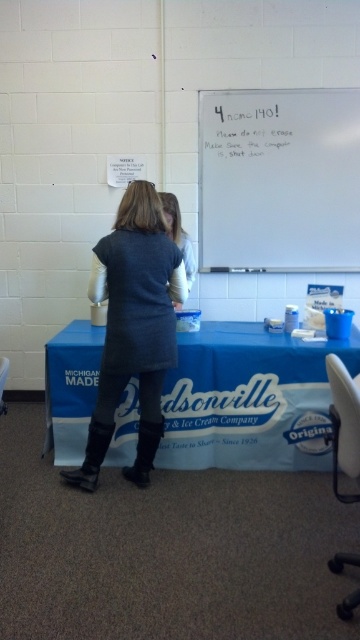
Can you confirm if white matte marker at upper center is positioned above black leather boot at lower left?

Indeed, white matte marker at upper center is positioned over black leather boot at lower left.

Does white matte marker at upper center appear on the left side of black leather boot at lower left?

No, white matte marker at upper center is not to the left of black leather boot at lower left.

Does point (236, 154) come in front of point (92, 464)?

No, (236, 154) is further to viewer.

In order to click on white matte marker at upper center in this screenshot , I will do `click(241, 125)`.

Who is positioned more to the right, black leather boot at lower left or light gray sweater at center?

From the viewer's perspective, light gray sweater at center appears more on the right side.

Who is taller, black leather boot at lower left or light gray sweater at center?

Standing taller between the two is light gray sweater at center.

The width and height of the screenshot is (360, 640). What do you see at coordinates (91, 456) in the screenshot?
I see `black leather boot at lower left` at bounding box center [91, 456].

Image resolution: width=360 pixels, height=640 pixels. I want to click on black leather boot at lower left, so click(x=91, y=456).

Does point (288, 138) come behind point (144, 477)?

Yes, it is behind point (144, 477).

Between point (344, 173) and point (153, 426), which one is positioned in front?

Point (153, 426) is more forward.

Is point (336, 211) behind point (147, 467)?

Yes.

The height and width of the screenshot is (640, 360). Find the location of `whiteboard at upper center`. whiteboard at upper center is located at coordinates (279, 180).